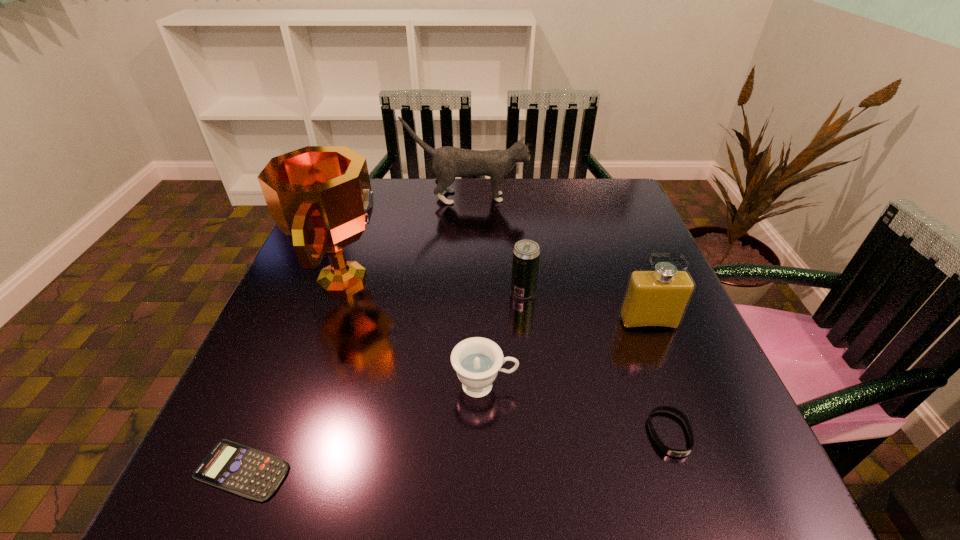
I want to click on vacant position in the image that satisfies the following two spatial constraints: 1. on the side of the award with the star emblem; 2. on the back side of the beer can, so click(340, 292).

The height and width of the screenshot is (540, 960). What are the coordinates of `free space that satisfies the following two spatial constraints: 1. on the front-facing side of the perfume; 2. on the side of the teacup with the handle` in the screenshot? It's located at (673, 385).